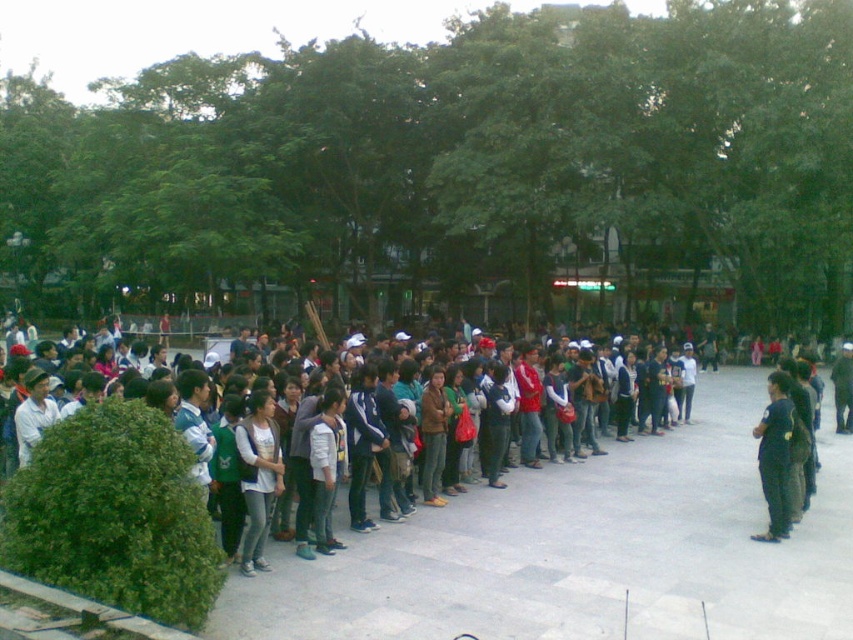
You are standing in the crowd at the front of the line and see two points in the image, point [241,419] and point [764,540]. Which point is closer to you?

Point [241,419] is closer to the viewer than point [764,540].

You are organizing a photo shoot and need to ensure that the light gray fabric jacket at center and the dark blue uniform at center can fit side by side in a frame. Given that the frame can accommodate a total width of 1.8 meters, can both items fit together?

The light gray fabric jacket at center is wider than the dark blue uniform at center. However, since the total width required for both items is not provided, it is impossible to determine if they can fit within the 1.8 meters frame. Additional information about their individual widths is needed to make an accurate assessment.

You are part of a crowd in the public square and need to reach the person in the dark blue uniform at center. There is a light gray fabric jacket at center blocking your path. Can you walk around them to the left or right?

The light gray fabric jacket at center is closer to the viewer than the dark blue uniform at center, so you can walk around to either side of the light gray fabric jacket at center to reach the dark blue uniform at center.